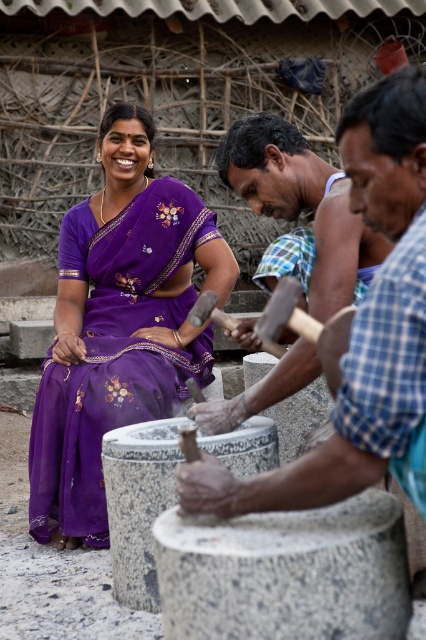
Is purple silk saree at center below smooth wooden hammer at center?

Yes.

Is purple silk saree at center further to the viewer compared to smooth wooden hammer at center?

Yes, purple silk saree at center is further from the viewer.

Is point (158, 204) positioned behind point (334, 195)?

Yes, point (158, 204) is behind point (334, 195).

Identify the location of purple silk saree at center. (118, 324).